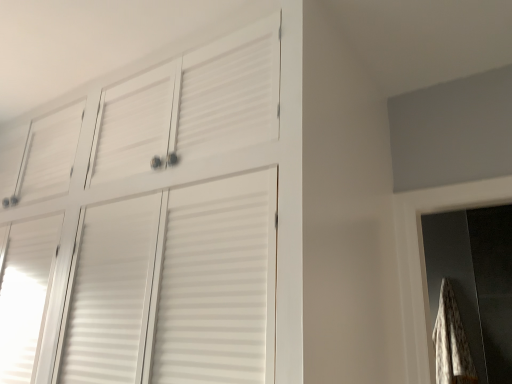
Describe the element at coordinates (451, 342) in the screenshot. This screenshot has height=384, width=512. I see `fluffy white curtain at lower right` at that location.

In the scene shown: What is the approximate width of fluffy white curtain at lower right?

The width of fluffy white curtain at lower right is 6.51 inches.

Measure the distance between fluffy white curtain at lower right and camera.

fluffy white curtain at lower right is 9.30 feet from camera.

Measure the distance between point (464,383) and camera.

Point (464,383) is 2.85 meters away from camera.

Find the location of a particular element. This screenshot has height=384, width=512. fluffy white curtain at lower right is located at coordinates (451, 342).

In order to face fluffy white curtain at lower right, should I rotate leftwards or rightwards?

It's best to rotate right around 24.642 degrees.

At what (x,y) coordinates should I click in order to perform the action: click on fluffy white curtain at lower right. Please return your answer as a coordinate pair (x, y). Looking at the image, I should click on (451, 342).